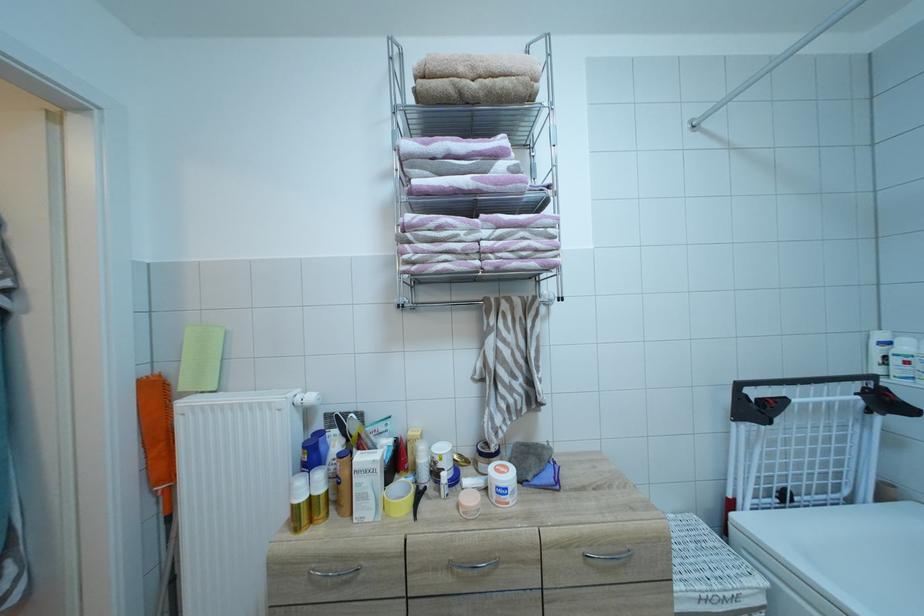
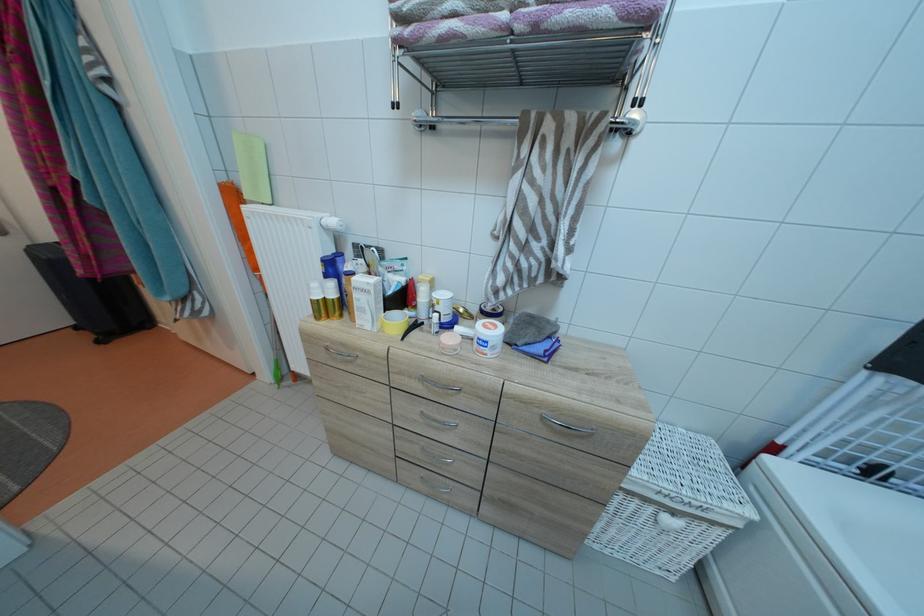
In the second image, find the point that corresponds to point 307,488 in the first image.

(322, 291)